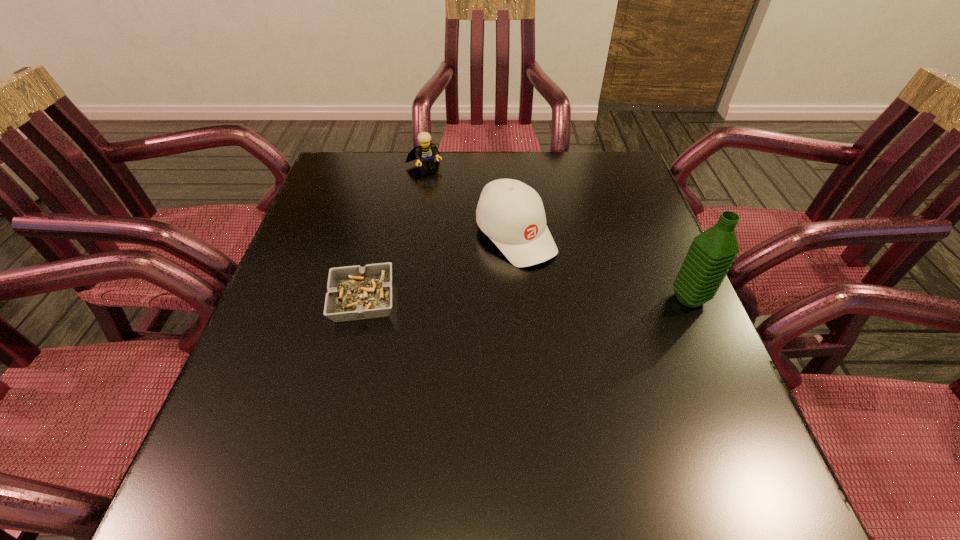
The width and height of the screenshot is (960, 540). I want to click on ashtray, so click(x=354, y=293).

Find the location of a particular element. the tallest object is located at coordinates (711, 254).

Where is `the rightmost object`? the rightmost object is located at coordinates (711, 254).

Image resolution: width=960 pixels, height=540 pixels. In order to click on baseball cap in this screenshot , I will do `click(511, 213)`.

Locate an element on the screen. Image resolution: width=960 pixels, height=540 pixels. the second object from right to left is located at coordinates (511, 213).

Find the location of `the farthest object`. the farthest object is located at coordinates (424, 154).

Where is `free space located on the front of the ashtray`? free space located on the front of the ashtray is located at coordinates (339, 399).

You are a GUI agent. You are given a task and a screenshot of the screen. Output one action in this format:
    pyautogui.click(x=<x>, y=<y>)
    Task: Click on the free space located 0.300m on the left of the water bottle
    The width and height of the screenshot is (960, 540).
    Given the screenshot: What is the action you would take?
    pyautogui.click(x=532, y=299)

Identify the location of free space located on the front-facing side of the baseball cap. (603, 335).

Locate an element on the screen. Image resolution: width=960 pixels, height=540 pixels. free space located 0.250m on the front-facing side of the baseball cap is located at coordinates (610, 342).